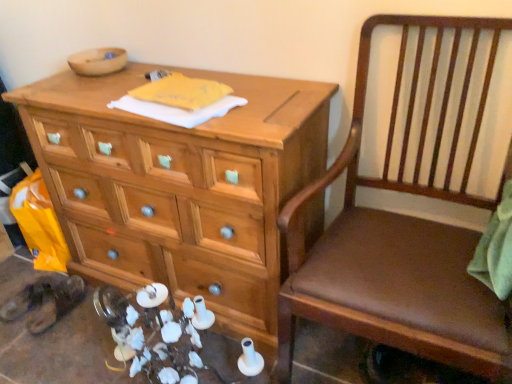
Find the location of a particular element. The height and width of the screenshot is (384, 512). free space above natural wood chest of drawers at center (from a real-world perspective) is located at coordinates (195, 74).